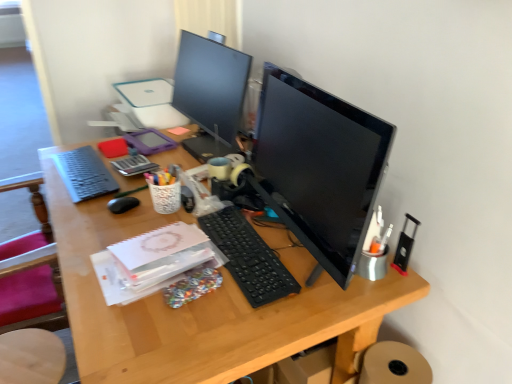
Describe the element at coordinates (404, 246) in the screenshot. I see `metallic black stapler at right, the first stationery from the bottom` at that location.

This screenshot has height=384, width=512. I want to click on black matte mouse at center-left, so click(x=122, y=204).

Identify the location of black plastic keyboard at center, which is counted as the 2th computer keyboard, starting from the left. This screenshot has width=512, height=384. [x=248, y=257].

The width and height of the screenshot is (512, 384). Describe the element at coordinates (84, 174) in the screenshot. I see `matte black keyboard at left, the 1th computer keyboard viewed from the left` at that location.

In order to face wooden seat at lower left, should I rotate leftwards or rightwards?

Turn left by 27.109 degrees to look at wooden seat at lower left.

This screenshot has height=384, width=512. What do you see at coordinates (149, 141) in the screenshot?
I see `matte plastic tablet at center-left, placed as the 1th stationery when sorted from back to front` at bounding box center [149, 141].

The height and width of the screenshot is (384, 512). In order to click on black glossy monitor at center, the first computer monitor from the right in this screenshot , I will do tap(319, 167).

Locate an element on the screen. This screenshot has height=384, width=512. metallic black stapler at right, the first stationery from the bottom is located at coordinates (404, 246).

Is metallic black stapler at right, the 2th stationery viewed from the top, turned away from black matte mouse at center-left?

No, metallic black stapler at right, the 2th stationery viewed from the top, is not facing the opposite direction of black matte mouse at center-left.

Can you confirm if metallic black stapler at right, the 2th stationery from the left, is taller than black matte mouse at center-left?

Yes.

Which object is closer to the camera, metallic black stapler at right, the first stationery from the bottom, or black matte mouse at center-left?

metallic black stapler at right, the first stationery from the bottom, is closer to the camera.

Considering the points (401, 259) and (116, 200), which point is behind, point (401, 259) or point (116, 200)?

Positioned behind is point (116, 200).

Can you tell me how much black matte mouse at center-left and wooden seat at lower left differ in facing direction?

The angle between the facing direction of black matte mouse at center-left and the facing direction of wooden seat at lower left is 156 degrees.

Which point is more distant from viewer, (119, 202) or (44, 341)?

The point (119, 202) is behind.

Is black matte mouse at center-left at the left side of wooden seat at lower left?

No, black matte mouse at center-left is not to the left of wooden seat at lower left.

Does black matte mouse at center-left contain matte plastic tablet at center-left, which is the 2th stationery from right to left?

No, matte plastic tablet at center-left, which is the 2th stationery from right to left, is not surrounded by black matte mouse at center-left.

Is black matte mouse at center-left aimed at matte plastic tablet at center-left, the first stationery in the top-to-bottom sequence?

No, black matte mouse at center-left is not aimed at matte plastic tablet at center-left, the first stationery in the top-to-bottom sequence.

Can you confirm if black matte mouse at center-left is wider than matte plastic tablet at center-left, placed as the 1th stationery when sorted from back to front?

Incorrect, the width of black matte mouse at center-left does not surpass that of matte plastic tablet at center-left, placed as the 1th stationery when sorted from back to front.

Which of these two, black matte mouse at center-left or matte plastic tablet at center-left, placed as the 1th stationery when sorted from back to front, stands taller?

With more height is matte plastic tablet at center-left, placed as the 1th stationery when sorted from back to front.

Looking at their sizes, would you say matte black keyboard at left, the first computer keyboard positioned from the back, is wider or thinner than matte plastic tablet at center-left, the first stationery in the top-to-bottom sequence?

Considering their sizes, matte black keyboard at left, the first computer keyboard positioned from the back, looks slimmer than matte plastic tablet at center-left, the first stationery in the top-to-bottom sequence.

Consider the image. Between matte black keyboard at left, the first computer keyboard positioned from the back, and matte plastic tablet at center-left, the first stationery in the top-to-bottom sequence, which one has less height?

matte black keyboard at left, the first computer keyboard positioned from the back.

Is matte black keyboard at left, positioned as the second computer keyboard in front-to-back order, far away from matte plastic tablet at center-left, the first stationery in the top-to-bottom sequence?

No, matte black keyboard at left, positioned as the second computer keyboard in front-to-back order, is in close proximity to matte plastic tablet at center-left, the first stationery in the top-to-bottom sequence.

Looking at this image, choose the correct answer: Is matte black keyboard at left, the second computer keyboard positioned from the bottom, inside matte plastic tablet at center-left, which is counted as the 2th stationery, starting from the bottom, or outside it?

matte black keyboard at left, the second computer keyboard positioned from the bottom, is spatially situated outside matte plastic tablet at center-left, which is counted as the 2th stationery, starting from the bottom.

Could you tell me if metallic black stapler at right, which is the 1th stationery in right-to-left order, is facing black glossy monitor at center, the second computer monitor when ordered from back to front?

Yes, metallic black stapler at right, which is the 1th stationery in right-to-left order, is aimed at black glossy monitor at center, the second computer monitor when ordered from back to front.

Considering the relative sizes of metallic black stapler at right, the 2th stationery from the left, and black glossy monitor at center, which is the second computer monitor from left to right, in the image provided, is metallic black stapler at right, the 2th stationery from the left, smaller than black glossy monitor at center, which is the second computer monitor from left to right,?

Correct, metallic black stapler at right, the 2th stationery from the left, occupies less space than black glossy monitor at center, which is the second computer monitor from left to right.

Is metallic black stapler at right, which is the 1th stationery in right-to-left order, not near black glossy monitor at center, the first computer monitor from the right?

They are positioned close to each other.

Considering the positions of objects metallic black stapler at right, the 2th stationery from the left, and black glossy monitor at center, the second computer monitor when ordered from back to front, in the image provided, who is more to the right, metallic black stapler at right, the 2th stationery from the left, or black glossy monitor at center, the second computer monitor when ordered from back to front,?

From the viewer's perspective, metallic black stapler at right, the 2th stationery from the left, appears more on the right side.

Does point (267, 125) lie in front of point (128, 209)?

Yes, it is.

Considering the sizes of objects black glossy monitor at center, the second computer monitor when ordered from back to front, and black matte mouse at center-left in the image provided, who is taller, black glossy monitor at center, the second computer monitor when ordered from back to front, or black matte mouse at center-left?

Standing taller between the two is black glossy monitor at center, the second computer monitor when ordered from back to front.

Which of these two, black glossy monitor at center, the second computer monitor when ordered from back to front, or black matte mouse at center-left, is wider?

black glossy monitor at center, the second computer monitor when ordered from back to front, is wider.

Considering the sizes of objects black glossy monitor at center, the second computer monitor when ordered from back to front, and black matte mouse at center-left in the image provided, who is bigger, black glossy monitor at center, the second computer monitor when ordered from back to front, or black matte mouse at center-left?

black glossy monitor at center, the second computer monitor when ordered from back to front, is bigger.

How much distance is there between matte plastic tablet at center-left, which is the 2th stationery from right to left, and black glossy monitor at center, which is the second computer monitor from left to right?

matte plastic tablet at center-left, which is the 2th stationery from right to left, and black glossy monitor at center, which is the second computer monitor from left to right, are 34.25 inches apart from each other.

Is point (128, 135) positioned in front of point (352, 253)?

That is False.

Could you tell me if matte plastic tablet at center-left, placed as the 1th stationery when sorted from back to front, is turned towards black glossy monitor at center, the first computer monitor from the right?

No, matte plastic tablet at center-left, placed as the 1th stationery when sorted from back to front, is not oriented towards black glossy monitor at center, the first computer monitor from the right.

Which object is more forward, matte plastic tablet at center-left, placed as the 1th stationery when sorted from back to front, or black glossy monitor at center, the second computer monitor when ordered from back to front?

black glossy monitor at center, the second computer monitor when ordered from back to front, is closer to the camera.

The width and height of the screenshot is (512, 384). Identify the location of stationery on the right of black matte mouse at center-left. (404, 246).

Locate an element on the screen. computer chair in front of the black matte mouse at center-left is located at coordinates (31, 357).

Considering their positions, is matte plastic tablet at center-left, the first stationery in the top-to-bottom sequence, positioned further to black plastic keyboard at center, which is counted as the 1th computer keyboard, starting from the right, than black glossy monitor at upper center, the first computer monitor positioned from the back?

Among the two, matte plastic tablet at center-left, the first stationery in the top-to-bottom sequence, is located further to black plastic keyboard at center, which is counted as the 1th computer keyboard, starting from the right.

Considering their positions, is black matte mouse at center-left positioned further to wooden seat at lower left than black glossy monitor at center, the first computer monitor from the right?

black glossy monitor at center, the first computer monitor from the right, is further to wooden seat at lower left.

Looking at the image, which one is located closer to black glossy monitor at center, the first computer monitor from the right, black plastic keyboard at center, which appears as the first computer keyboard when ordered from the bottom, or metallic black stapler at right, which appears as the first stationery when viewed from the front?

black plastic keyboard at center, which appears as the first computer keyboard when ordered from the bottom, is closer to black glossy monitor at center, the first computer monitor from the right.

Estimate the real-world distances between objects in this image. Which object is closer to wooden seat at lower left, metallic black stapler at right, the 2th stationery viewed from the top, or black plastic keyboard at center, placed as the second computer keyboard when sorted from back to front?

black plastic keyboard at center, placed as the second computer keyboard when sorted from back to front, is positioned closer to the anchor wooden seat at lower left.

Based on their spatial positions, is matte black keyboard at left, which is counted as the 2th computer keyboard, starting from the right, or black glossy monitor at center, the second computer monitor when ordered from back to front, closer to wooden seat at lower left?

Among the two, matte black keyboard at left, which is counted as the 2th computer keyboard, starting from the right, is located nearer to wooden seat at lower left.

Considering their positions, is black matte mouse at center-left positioned further to matte plastic tablet at center-left, which is the 2th stationery from right to left, than wooden seat at lower left?

The object further to matte plastic tablet at center-left, which is the 2th stationery from right to left, is wooden seat at lower left.

When comparing their distances from matte black keyboard at left, positioned as the second computer keyboard in front-to-back order, does matte plastic tablet at center-left, placed as the 1th stationery when sorted from back to front, or black glossy monitor at upper center, the first computer monitor viewed from the left, seem further?

black glossy monitor at upper center, the first computer monitor viewed from the left.

When comparing their distances from matte plastic tablet at center-left, the 1th stationery when ordered from left to right, does black plastic keyboard at center, which appears as the first computer keyboard when ordered from the bottom, or black glossy monitor at center, which is counted as the 1th computer monitor, starting from the front, seem closer?

black plastic keyboard at center, which appears as the first computer keyboard when ordered from the bottom.

Identify the location of mouse located between matte black keyboard at left, the first computer keyboard positioned from the back, and metallic black stapler at right, the first stationery from the bottom, in the left-right direction. (122, 204).

You are a GUI agent. You are given a task and a screenshot of the screen. Output one action in this format:
    pyautogui.click(x=<x>, y=<y>)
    Task: Click on the computer keyboard between wooden seat at lower left and black plastic keyboard at center, positioned as the first computer keyboard in front-to-back order, in the horizontal direction
    Image resolution: width=512 pixels, height=384 pixels.
    Given the screenshot: What is the action you would take?
    pyautogui.click(x=84, y=174)

Identify the location of mouse between matte black keyboard at left, the first computer keyboard positioned from the back, and black plastic keyboard at center, which appears as the first computer keyboard when ordered from the bottom, from left to right. Image resolution: width=512 pixels, height=384 pixels. (122, 204).

This screenshot has height=384, width=512. In order to click on mouse positioned between black plastic keyboard at center, which appears as the first computer keyboard when ordered from the bottom, and matte plastic tablet at center-left, which is the 2th stationery in front-to-back order, from near to far in this screenshot , I will do `click(122, 204)`.